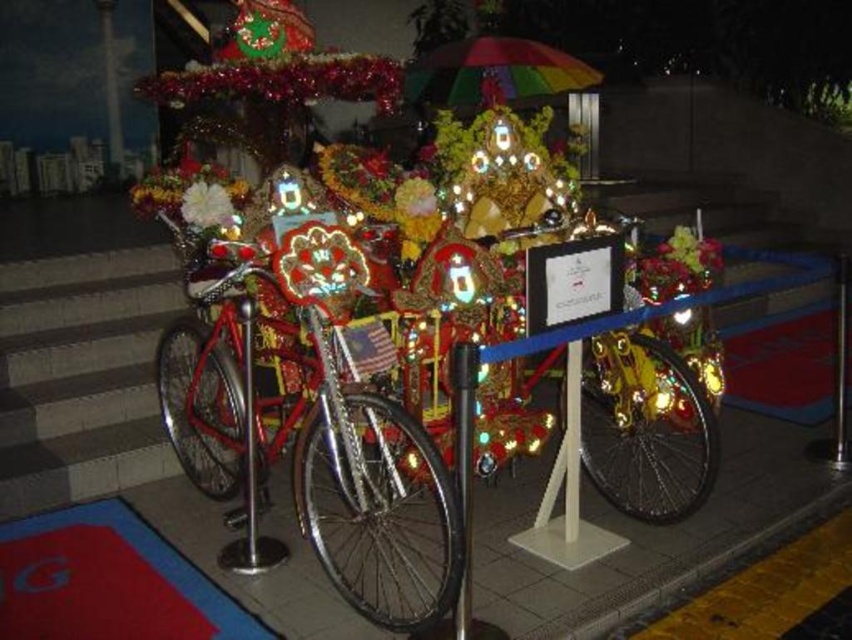
What do you see at coordinates (646, 428) in the screenshot? I see `shiny gold bicycle at center` at bounding box center [646, 428].

Which is more to the right, shiny gold bicycle at center or metallic silver pole at center?

Positioned to the right is shiny gold bicycle at center.

Locate an element on the screen. shiny gold bicycle at center is located at coordinates (646, 428).

Locate an element on the screen. Image resolution: width=852 pixels, height=640 pixels. shiny gold bicycle at center is located at coordinates (646, 428).

Identify the location of shiny metallic bicycle at center. The height and width of the screenshot is (640, 852). (320, 461).

Does shiny metallic bicycle at center have a greater width compared to metallic pole at center?

Yes.

Does shiny metallic bicycle at center appear over metallic pole at center?

No, shiny metallic bicycle at center is not above metallic pole at center.

Between point (348, 420) and point (839, 307), which one is positioned behind?

Positioned behind is point (839, 307).

This screenshot has width=852, height=640. In order to click on shiny metallic bicycle at center in this screenshot , I will do `click(320, 461)`.